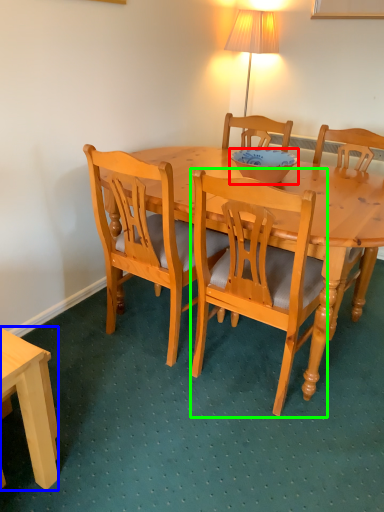
Question: Considering the real-world distances, which object is farthest from bowl (highlighted by a red box)? desk (highlighted by a blue box) or chair (highlighted by a green box)?

Choices:
 (A) desk
 (B) chair

Answer: (A)